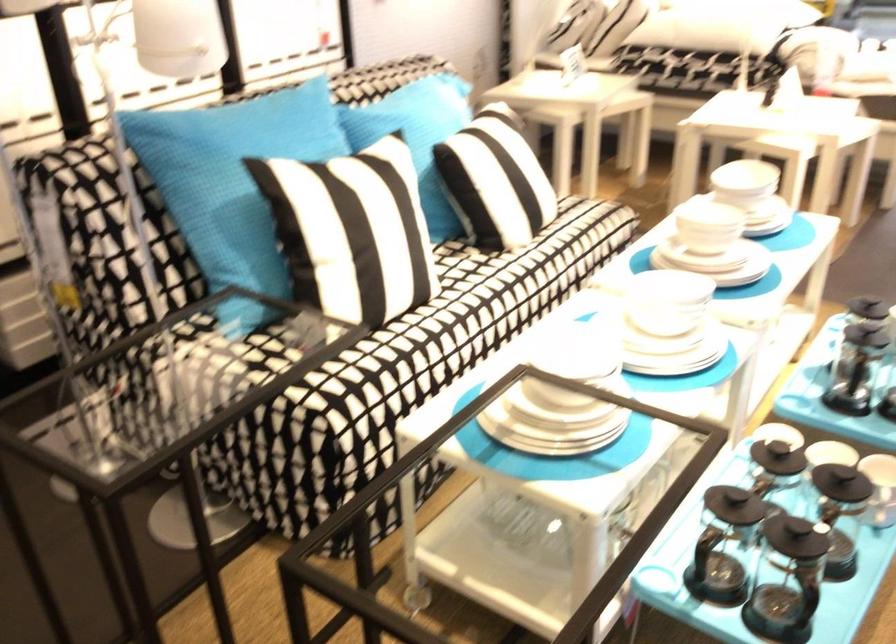
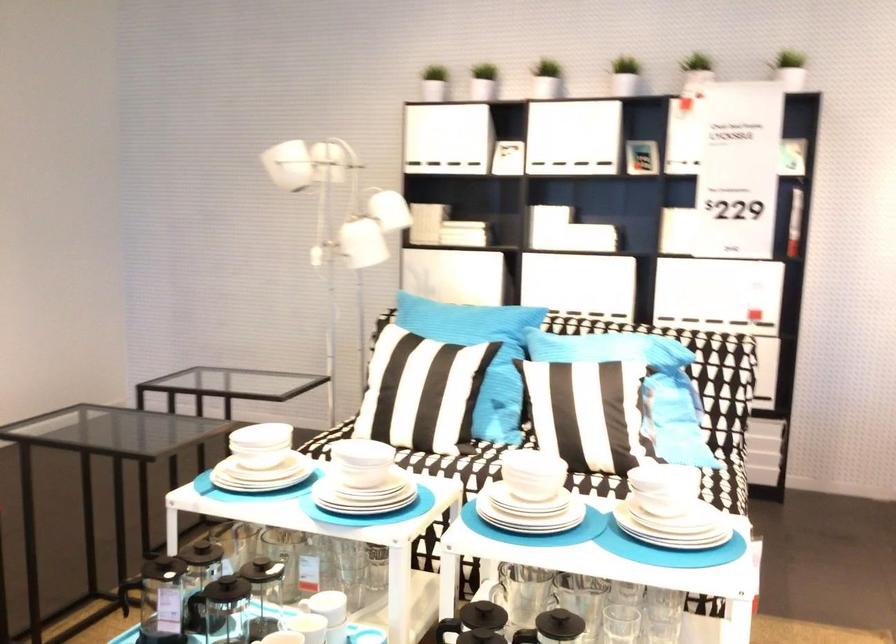
Where in the second image is the point corresponding to (355,239) from the first image?

(398, 377)